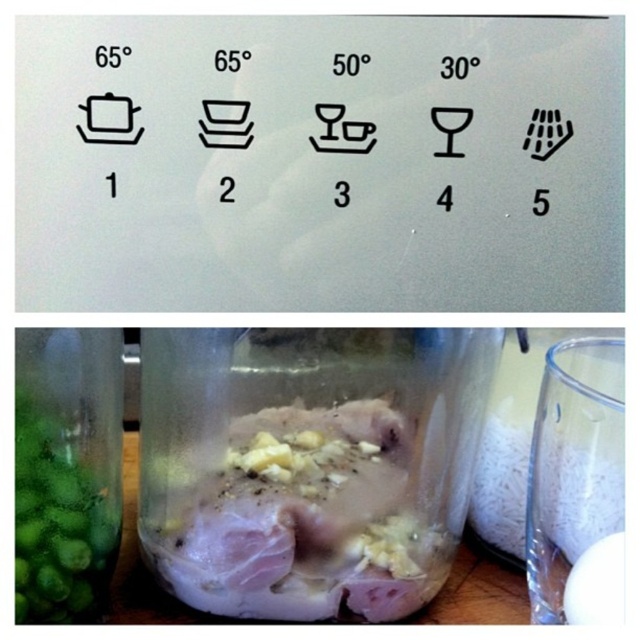
You are preparing to pack a lunchbox and need to place both the translucent plastic chicken at center and the transparent glass jar at right inside. Based on their sizes, which object should you place first to ensure both fit properly?

The translucent plastic chicken at center is taller than the transparent glass jar at right, so you should place the taller translucent plastic chicken at center first to make space for the shorter jar.

You are preparing to pack a lunchbox and have both the translucent plastic chicken at center and the green matte glass jar at lower left in front of you. Which item takes up more vertical space when placed upright?

The translucent plastic chicken at center has a greater height compared to the green matte glass jar at lower left, so it takes up more vertical space when placed upright.

You are organizing a pantry and need to place the green matte glass jar at lower left and the transparent glass jar at right on a shelf. If the shelf has limited space, which jar should you place first to ensure both fit?

You should place the transparent glass jar at right first because the green matte glass jar at lower left occupies less space. This way, there will be enough room for both jars on the shelf.